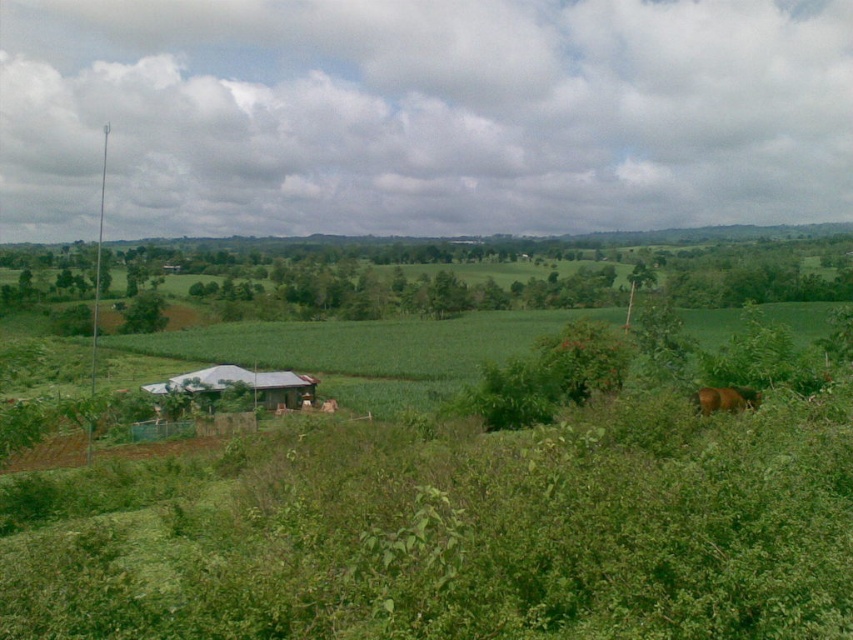
You are a farmer who needs to decide where to place a new fence. You have two options for locations based on the image. The first option is near the metallic gray hut at lower left, and the second is near the brown furry horse at lower right. Considering the space available, which location would allow for a wider fence section?

The metallic gray hut at lower left has a larger width than the brown furry horse at lower right, so placing the fence near the metallic gray hut at lower left would allow for a wider fence section.